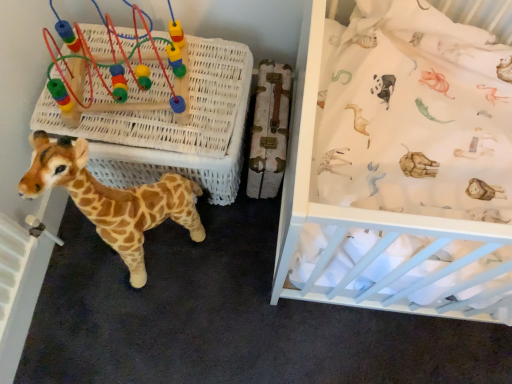
Locate an element on the screen. The height and width of the screenshot is (384, 512). vacant space underneath plastic beads at upper left (from a real-world perspective) is located at coordinates (119, 109).